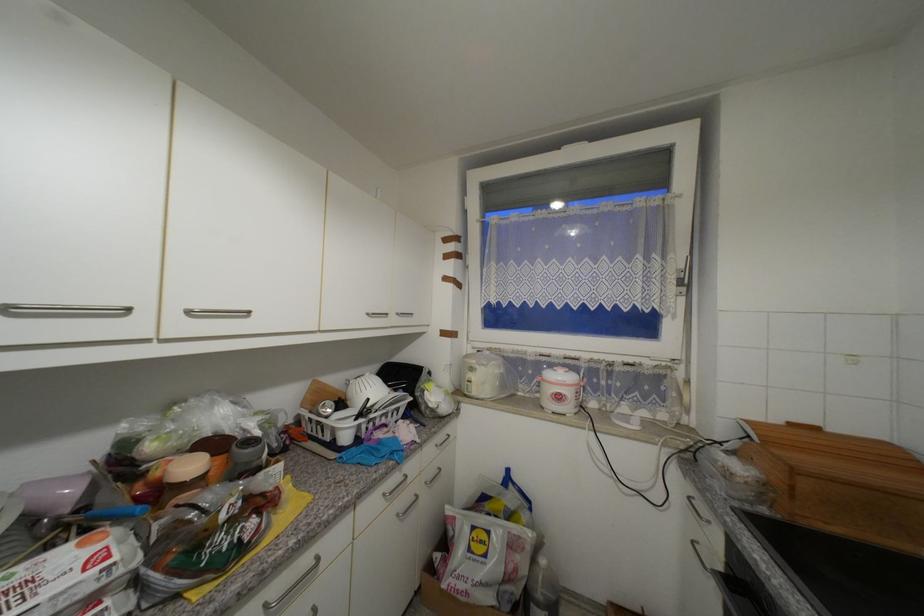
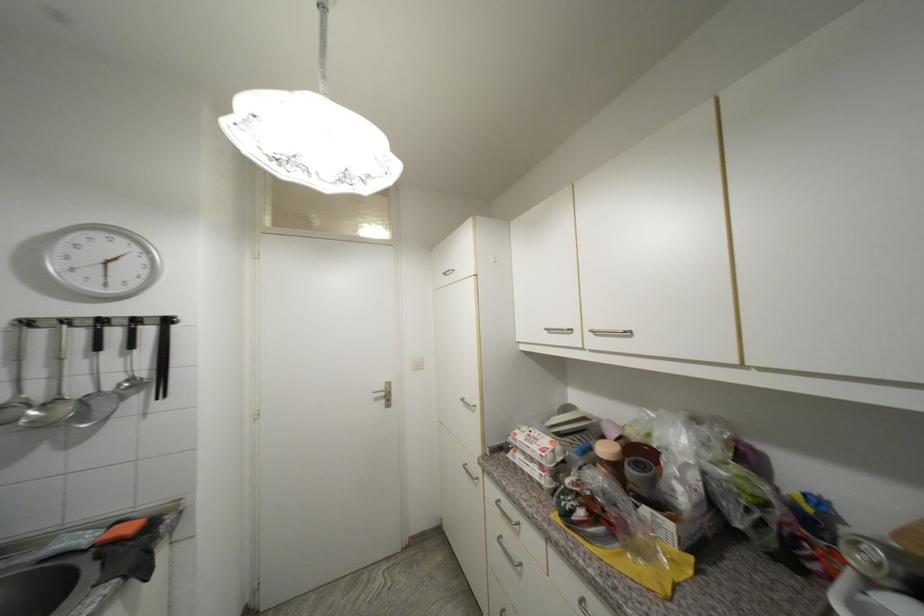
The point at (203, 309) is marked in the first image. Where is the corresponding point in the second image?

(601, 330)